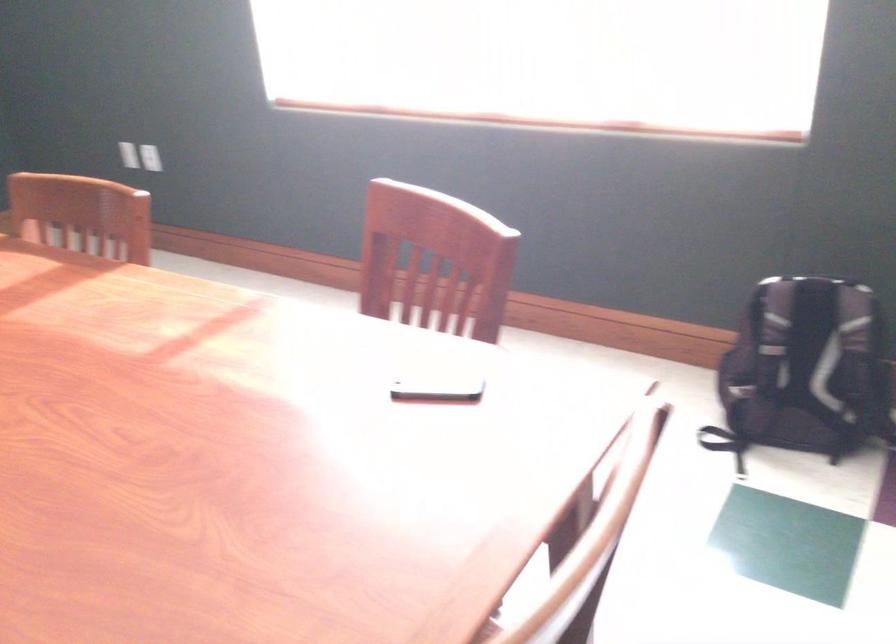
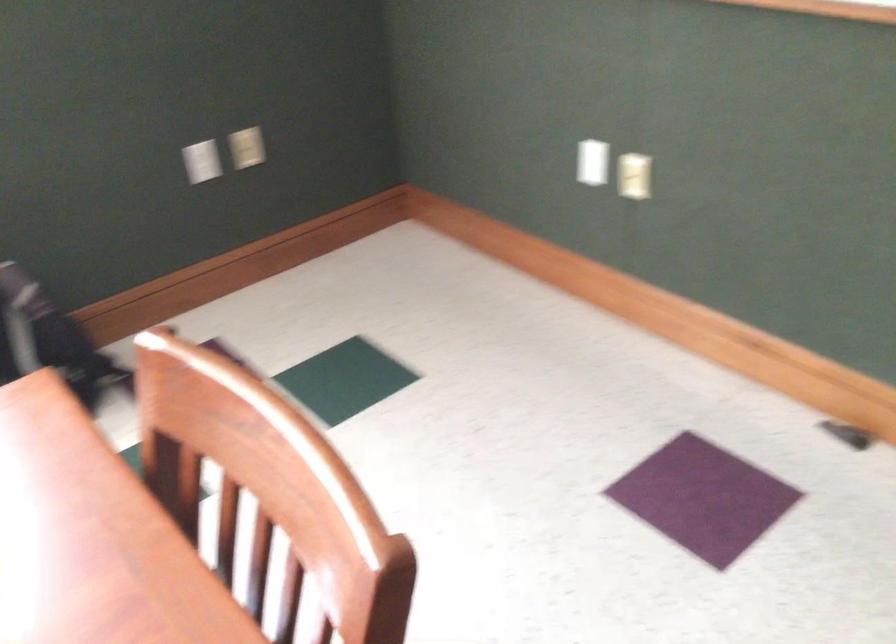
Consider the image. The first image is from the beginning of the video and the second image is from the end. How did the camera likely rotate when shooting the video?

The rotation direction of the camera is right-down.